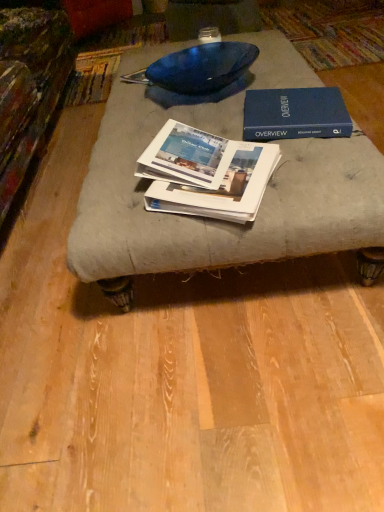
Locate an element on the screen. The image size is (384, 512). free space in front of white paper booklet at center, which is the second book in top-to-bottom order is located at coordinates (202, 184).